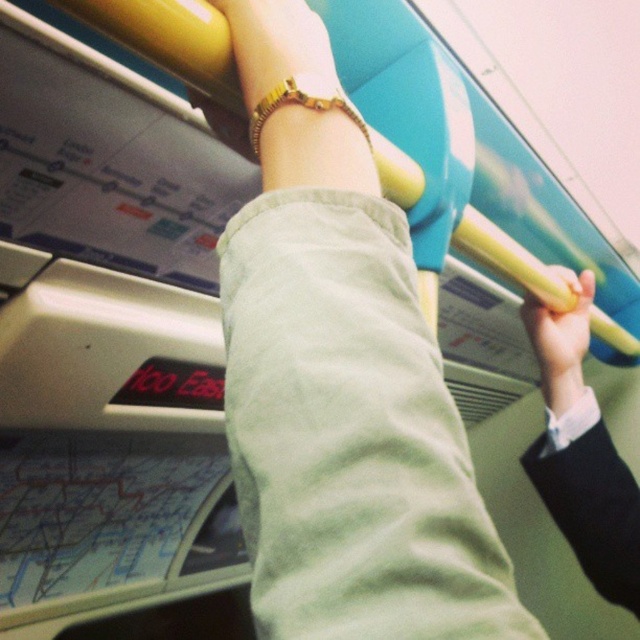
You are a passenger on a train and you want to know which object is taller between the yellow rubber grip at upper right and the gold textured bracelet at upper center. Can you tell me?

The yellow rubber grip at upper right is much taller than the gold textured bracelet at upper center.

You are a passenger on a train and you want to sit down. There is a seat next to the light green cotton pants at center and the yellow rubber grip at upper right. Which object is closer to the seat?

The light green cotton pants at center is closer to the seat because it is positioned over the yellow rubber grip at upper right, indicating it is nearer in the scene.

You are a passenger on a train and need to hold onto something while standing. You see the yellow rubber grip at upper right and the gold textured bracelet at upper center. Which object is positioned to the right side of the other?

The yellow rubber grip at upper right is to the right of the gold textured bracelet at upper center.